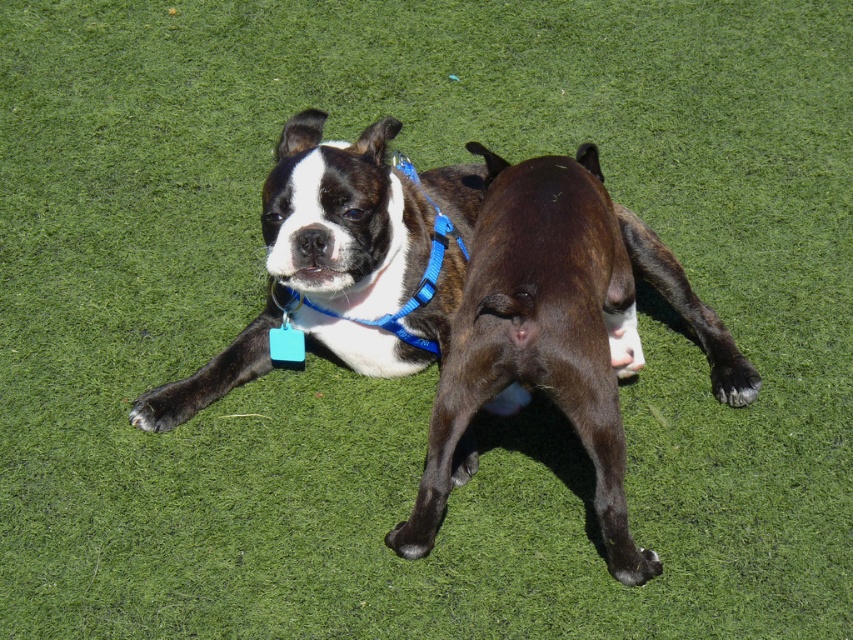
Is shiny black dog at center below brown matte dog at center?

Actually, shiny black dog at center is above brown matte dog at center.

Does shiny black dog at center lie in front of brown matte dog at center?

No.

Which is in front, point (339, 212) or point (448, 458)?

Point (448, 458)

This screenshot has width=853, height=640. What are the coordinates of `shiny black dog at center` in the screenshot? It's located at (341, 262).